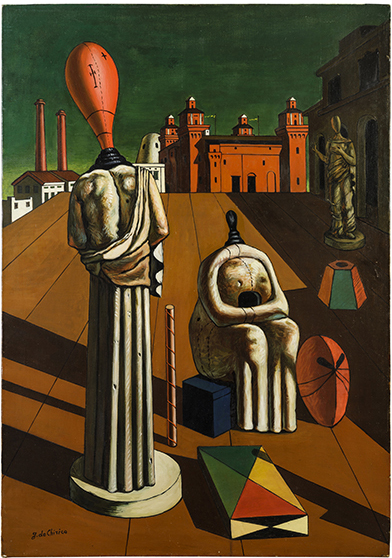
The image size is (392, 558). I want to click on statue, so pos(253,327), pos(131,346).